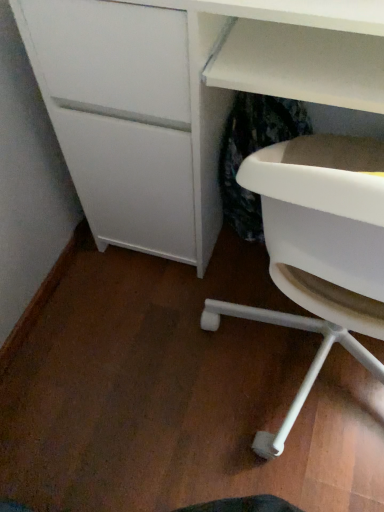
The height and width of the screenshot is (512, 384). Describe the element at coordinates (183, 97) in the screenshot. I see `white matte desk at center` at that location.

Find the location of a particular element. The image size is (384, 512). white matte desk at center is located at coordinates (183, 97).

You are a GUI agent. You are given a task and a screenshot of the screen. Output one action in this format:
    pyautogui.click(x=<x>, y=<y>)
    Task: Click on the white matte chair at lower right
    Image resolution: width=384 pixels, height=512 pixels.
    Given the screenshot: What is the action you would take?
    pyautogui.click(x=323, y=207)

The width and height of the screenshot is (384, 512). Describe the element at coordinates (323, 207) in the screenshot. I see `white matte chair at lower right` at that location.

Find the location of a particular element. white matte desk at center is located at coordinates (183, 97).

Considering the relative positions of white matte chair at lower right and white matte desk at center in the image provided, is white matte chair at lower right to the right of white matte desk at center from the viewer's perspective?

Correct, you'll find white matte chair at lower right to the right of white matte desk at center.

Relative to white matte desk at center, is white matte chair at lower right in front or behind?

white matte chair at lower right is in front of white matte desk at center.

Is point (287, 263) farther from viewer compared to point (358, 72)?

No, (287, 263) is in front of (358, 72).

From the image's perspective, between white matte chair at lower right and white matte desk at center, who is located below?

white matte chair at lower right.

From a real-world perspective, who is located lower, white matte chair at lower right or white matte desk at center?

white matte desk at center is physically lower.

Can you confirm if white matte chair at lower right is wider than white matte desk at center?

In fact, white matte chair at lower right might be narrower than white matte desk at center.

Does white matte chair at lower right have a lesser height compared to white matte desk at center?

Yes.

Consider the image. Is white matte chair at lower right bigger than white matte desk at center?

No.

Does white matte chair at lower right contain white matte desk at center?

No, white matte desk at center is not surrounded by white matte chair at lower right.

Is there a large distance between white matte chair at lower right and white matte desk at center?

No, white matte chair at lower right is not far away from white matte desk at center.

Is white matte chair at lower right aimed at white matte desk at center?

Yes, white matte chair at lower right is turned towards white matte desk at center.

What's the angular difference between white matte chair at lower right and white matte desk at center's facing directions?

The angle between the facing direction of white matte chair at lower right and the facing direction of white matte desk at center is 180 degrees.

How far apart are white matte chair at lower right and white matte desk at center?

white matte chair at lower right is 27.26 centimeters from white matte desk at center.

You are a GUI agent. You are given a task and a screenshot of the screen. Output one action in this format:
    pyautogui.click(x=<x>, y=<y>)
    Task: Click on the cabinetry located below the white matte desk at center (from the image's perspective)
    
    Given the screenshot: What is the action you would take?
    pyautogui.click(x=323, y=207)

Which is more to the right, white matte desk at center or white matte chair at lower right?

white matte chair at lower right is more to the right.

Based on the photo, considering their positions, is white matte desk at center located in front of or behind white matte chair at lower right?

white matte desk at center is positioned farther from the viewer than white matte chair at lower right.

Does point (203, 224) come in front of point (350, 254)?

No, (203, 224) is behind (350, 254).

From the image's perspective, is white matte desk at center above or below white matte chair at lower right?

Clearly, from the image's perspective, white matte desk at center is above white matte chair at lower right.

From a real-world perspective, does white matte desk at center sit lower than white matte chair at lower right?

Yes, from a real-world perspective, white matte desk at center is under white matte chair at lower right.

In terms of width, does white matte desk at center look wider or thinner when compared to white matte chair at lower right?

Clearly, white matte desk at center has more width compared to white matte chair at lower right.

Considering the sizes of objects white matte desk at center and white matte chair at lower right in the image provided, who is taller, white matte desk at center or white matte chair at lower right?

Standing taller between the two is white matte desk at center.

Can you confirm if white matte desk at center is bigger than white matte chair at lower right?

Yes.

Is white matte desk at center situated inside white matte chair at lower right or outside?

white matte desk at center lies outside white matte chair at lower right.

Based on the photo, is white matte desk at center positioned far away from white matte chair at lower right?

white matte desk at center is actually quite close to white matte chair at lower right.

Is white matte desk at center looking in the opposite direction of white matte chair at lower right?

No.

The image size is (384, 512). In order to click on cabinetry located on the right of white matte desk at center in this screenshot , I will do `click(323, 207)`.

The width and height of the screenshot is (384, 512). I want to click on desk behind the white matte chair at lower right, so tap(183, 97).

At what (x,y) coordinates should I click in order to perform the action: click on cabinetry on the right of white matte desk at center. Please return your answer as a coordinate pair (x, y). Looking at the image, I should click on (323, 207).